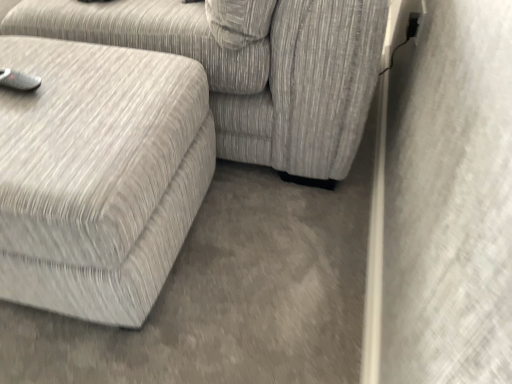
The width and height of the screenshot is (512, 384). Describe the element at coordinates (99, 175) in the screenshot. I see `textured gray ottoman at left, the 2th studio couch in the top-to-bottom sequence` at that location.

I want to click on textured gray ottoman at left, the 2th studio couch in the top-to-bottom sequence, so pos(99,175).

Measure the distance between textured gray fabric couch at lower left, marked as the 1th studio couch in a top-to-bottom arrangement, and camera.

The depth of textured gray fabric couch at lower left, marked as the 1th studio couch in a top-to-bottom arrangement, is 34.66 inches.

Where is `textured gray fabric couch at lower left, marked as the 1th studio couch in a top-to-bottom arrangement`? This screenshot has width=512, height=384. textured gray fabric couch at lower left, marked as the 1th studio couch in a top-to-bottom arrangement is located at coordinates (250, 70).

The height and width of the screenshot is (384, 512). What do you see at coordinates (250, 70) in the screenshot?
I see `textured gray fabric couch at lower left, marked as the 2th studio couch in a bottom-to-top arrangement` at bounding box center [250, 70].

Measure the distance between point (335, 91) and camera.

Point (335, 91) is 1.05 meters from camera.

This screenshot has width=512, height=384. I want to click on textured gray ottoman at left, which is the 1th studio couch in bottom-to-top order, so click(x=99, y=175).

Consider the image. Is textured gray ottoman at left, the 2th studio couch in the top-to-bottom sequence, to the left or to the right of textured gray fabric couch at lower left, marked as the 1th studio couch in a top-to-bottom arrangement, in the image?

In the image, textured gray ottoman at left, the 2th studio couch in the top-to-bottom sequence, appears on the right side of textured gray fabric couch at lower left, marked as the 1th studio couch in a top-to-bottom arrangement.

Is textured gray ottoman at left, the 2th studio couch in the top-to-bottom sequence, positioned in front of textured gray fabric couch at lower left, marked as the 1th studio couch in a top-to-bottom arrangement?

That is True.

Considering the points (67, 262) and (139, 29), which point is behind, point (67, 262) or point (139, 29)?

The point (139, 29) is farther.

Based on the photo, from the image's perspective, would you say textured gray ottoman at left, the 2th studio couch in the top-to-bottom sequence, is positioned over textured gray fabric couch at lower left, marked as the 2th studio couch in a bottom-to-top arrangement?

No.

From a real-world perspective, is textured gray ottoman at left, which is the 1th studio couch in bottom-to-top order, on top of textured gray fabric couch at lower left, marked as the 2th studio couch in a bottom-to-top arrangement?

Actually, textured gray ottoman at left, which is the 1th studio couch in bottom-to-top order, is physically below textured gray fabric couch at lower left, marked as the 2th studio couch in a bottom-to-top arrangement, in the real world.

Is textured gray ottoman at left, the 2th studio couch in the top-to-bottom sequence, thinner than textured gray fabric couch at lower left, marked as the 1th studio couch in a top-to-bottom arrangement?

Yes.

Based on the photo, is textured gray ottoman at left, which is the 1th studio couch in bottom-to-top order, taller or shorter than textured gray fabric couch at lower left, marked as the 1th studio couch in a top-to-bottom arrangement?

Clearly, textured gray ottoman at left, which is the 1th studio couch in bottom-to-top order, is shorter compared to textured gray fabric couch at lower left, marked as the 1th studio couch in a top-to-bottom arrangement.

Does textured gray ottoman at left, the 2th studio couch in the top-to-bottom sequence, have a larger size compared to textured gray fabric couch at lower left, marked as the 2th studio couch in a bottom-to-top arrangement?

Actually, textured gray ottoman at left, the 2th studio couch in the top-to-bottom sequence, might be smaller than textured gray fabric couch at lower left, marked as the 2th studio couch in a bottom-to-top arrangement.

Consider the image. Would you say textured gray ottoman at left, which is the 1th studio couch in bottom-to-top order, is inside or outside textured gray fabric couch at lower left, marked as the 1th studio couch in a top-to-bottom arrangement?

The correct answer is: outside.

Is textured gray ottoman at left, the 2th studio couch in the top-to-bottom sequence, with textured gray fabric couch at lower left, marked as the 1th studio couch in a top-to-bottom arrangement?

No, textured gray ottoman at left, the 2th studio couch in the top-to-bottom sequence, is not next to textured gray fabric couch at lower left, marked as the 1th studio couch in a top-to-bottom arrangement.

Is textured gray ottoman at left, the 2th studio couch in the top-to-bottom sequence, facing towards textured gray fabric couch at lower left, marked as the 1th studio couch in a top-to-bottom arrangement?

No, textured gray ottoman at left, the 2th studio couch in the top-to-bottom sequence, is not oriented towards textured gray fabric couch at lower left, marked as the 1th studio couch in a top-to-bottom arrangement.

At what (x,y) coordinates should I click in order to perform the action: click on studio couch above the textured gray ottoman at left, the 2th studio couch in the top-to-bottom sequence (from the image's perspective). Please return your answer as a coordinate pair (x, y). The image size is (512, 384). Looking at the image, I should click on (250, 70).

Considering the positions of objects textured gray fabric couch at lower left, marked as the 1th studio couch in a top-to-bottom arrangement, and textured gray ottoman at left, which is the 1th studio couch in bottom-to-top order, in the image provided, who is more to the left, textured gray fabric couch at lower left, marked as the 1th studio couch in a top-to-bottom arrangement, or textured gray ottoman at left, which is the 1th studio couch in bottom-to-top order,?

Positioned to the left is textured gray fabric couch at lower left, marked as the 1th studio couch in a top-to-bottom arrangement.

Does textured gray fabric couch at lower left, marked as the 2th studio couch in a bottom-to-top arrangement, lie in front of textured gray ottoman at left, the 2th studio couch in the top-to-bottom sequence?

No.

Which is behind, point (346, 169) or point (197, 200)?

The point (346, 169) is farther.

From the image's perspective, is textured gray fabric couch at lower left, marked as the 2th studio couch in a bottom-to-top arrangement, located beneath textured gray ottoman at left, which is the 1th studio couch in bottom-to-top order?

Incorrect, from the image's perspective, textured gray fabric couch at lower left, marked as the 2th studio couch in a bottom-to-top arrangement, is higher than textured gray ottoman at left, which is the 1th studio couch in bottom-to-top order.

Consider the image. From a real-world perspective, is textured gray fabric couch at lower left, marked as the 1th studio couch in a top-to-bottom arrangement, under textured gray ottoman at left, which is the 1th studio couch in bottom-to-top order?

No.

Between textured gray fabric couch at lower left, marked as the 2th studio couch in a bottom-to-top arrangement, and textured gray ottoman at left, which is the 1th studio couch in bottom-to-top order, which one has smaller width?

textured gray ottoman at left, which is the 1th studio couch in bottom-to-top order, is thinner.

From their relative heights in the image, would you say textured gray fabric couch at lower left, marked as the 2th studio couch in a bottom-to-top arrangement, is taller or shorter than textured gray ottoman at left, which is the 1th studio couch in bottom-to-top order?

Clearly, textured gray fabric couch at lower left, marked as the 2th studio couch in a bottom-to-top arrangement, is taller compared to textured gray ottoman at left, which is the 1th studio couch in bottom-to-top order.

Does textured gray fabric couch at lower left, marked as the 1th studio couch in a top-to-bottom arrangement, have a larger size compared to textured gray ottoman at left, the 2th studio couch in the top-to-bottom sequence?

Indeed, textured gray fabric couch at lower left, marked as the 1th studio couch in a top-to-bottom arrangement, has a larger size compared to textured gray ottoman at left, the 2th studio couch in the top-to-bottom sequence.

Is textured gray fabric couch at lower left, marked as the 1th studio couch in a top-to-bottom arrangement, spatially inside textured gray ottoman at left, the 2th studio couch in the top-to-bottom sequence, or outside of it?

textured gray fabric couch at lower left, marked as the 1th studio couch in a top-to-bottom arrangement, is outside textured gray ottoman at left, the 2th studio couch in the top-to-bottom sequence.

Is textured gray fabric couch at lower left, marked as the 2th studio couch in a bottom-to-top arrangement, placed right next to textured gray ottoman at left, the 2th studio couch in the top-to-bottom sequence?

No.

Is textured gray fabric couch at lower left, marked as the 1th studio couch in a top-to-bottom arrangement, facing away from textured gray ottoman at left, which is the 1th studio couch in bottom-to-top order?

That's not correct — textured gray fabric couch at lower left, marked as the 1th studio couch in a top-to-bottom arrangement, is not looking away from textured gray ottoman at left, which is the 1th studio couch in bottom-to-top order.

How different are the orientations of textured gray fabric couch at lower left, marked as the 1th studio couch in a top-to-bottom arrangement, and textured gray ottoman at left, which is the 1th studio couch in bottom-to-top order, in degrees?

0.947 degrees separate the facing orientations of textured gray fabric couch at lower left, marked as the 1th studio couch in a top-to-bottom arrangement, and textured gray ottoman at left, which is the 1th studio couch in bottom-to-top order.

In the image, there is a textured gray ottoman at left, the 2th studio couch in the top-to-bottom sequence. Where is `studio couch above it (from the image's perspective)`? The height and width of the screenshot is (384, 512). studio couch above it (from the image's perspective) is located at coordinates (250, 70).

Identify the location of studio couch that is in front of the textured gray fabric couch at lower left, marked as the 1th studio couch in a top-to-bottom arrangement. This screenshot has width=512, height=384. (99, 175).

The height and width of the screenshot is (384, 512). Find the location of `studio couch above the textured gray ottoman at left, the 2th studio couch in the top-to-bottom sequence (from a real-world perspective)`. studio couch above the textured gray ottoman at left, the 2th studio couch in the top-to-bottom sequence (from a real-world perspective) is located at coordinates (250, 70).